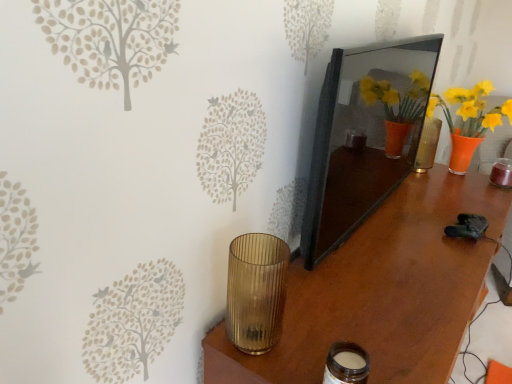
In order to click on vacant space that's between matte glass jar at lower center, which appears as the second candle holder when viewed from the left, and gold ribbed glass at lower left, placed as the 2th candle holder when sorted from right to left in this screenshot , I will do `click(297, 362)`.